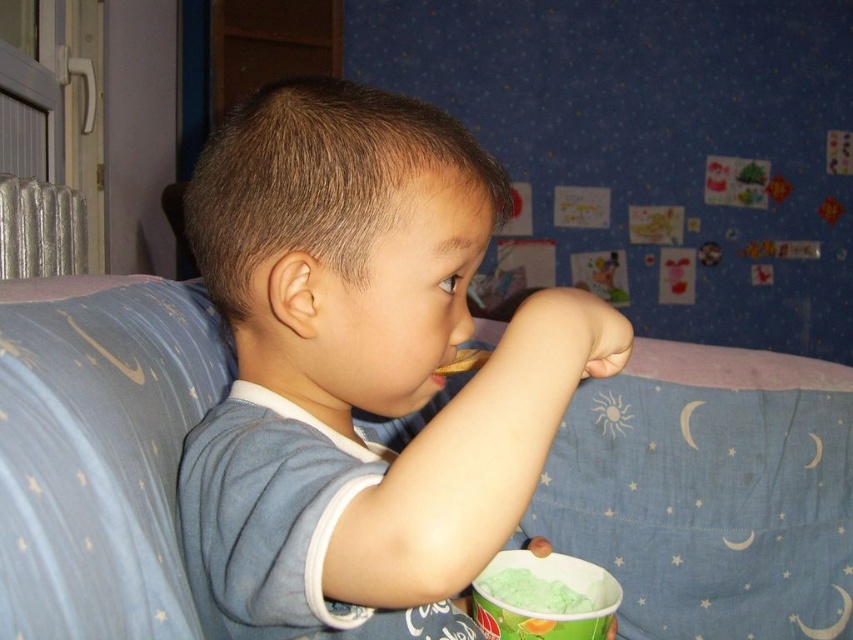
Does green matte yogurt cup at lower center have a greater width compared to brown crumbly cookie at lower center?

Yes.

Between point (583, 579) and point (471, 365), which one is positioned in front?

Point (471, 365) is in front.

Where is `green matte yogurt cup at lower center`? This screenshot has height=640, width=853. green matte yogurt cup at lower center is located at coordinates click(543, 596).

The image size is (853, 640). I want to click on green matte yogurt cup at lower center, so tap(543, 596).

Who is positioned more to the right, smooth blue shirt at center or brown crumbly cookie at lower center?

Positioned to the right is brown crumbly cookie at lower center.

Who is higher up, smooth blue shirt at center or brown crumbly cookie at lower center?

smooth blue shirt at center is higher up.

Locate an element on the screen. smooth blue shirt at center is located at coordinates (363, 364).

Who is positioned more to the right, blue fabric bed at center or green matte ice cream at lower center?

From the viewer's perspective, blue fabric bed at center appears more on the right side.

Image resolution: width=853 pixels, height=640 pixels. I want to click on blue fabric bed at center, so click(711, 492).